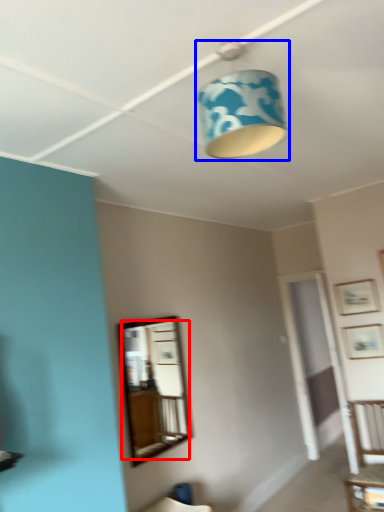
Question: Which object is further to the camera taking this photo, mirror (highlighted by a red box) or lamp (highlighted by a blue box)?

Choices:
 (A) mirror
 (B) lamp

Answer: (A)